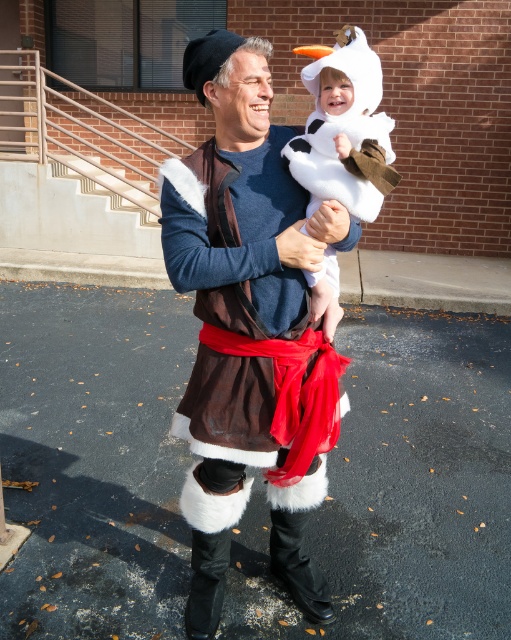
Can you confirm if fuzzy brown vest at center is taller than white fluffy costume at center?

Yes, fuzzy brown vest at center is taller than white fluffy costume at center.

Is point (251, 444) less distant than point (354, 180)?

No, it is behind (354, 180).

You are a GUI agent. You are given a task and a screenshot of the screen. Output one action in this format:
    pyautogui.click(x=<x>, y=<y>)
    Task: Click on the fuzzy brown vest at center
    The image size is (511, 640).
    Given the screenshot: What is the action you would take?
    pos(248,326)

Find the location of `fuzzy brown vest at center`. fuzzy brown vest at center is located at coordinates (248, 326).